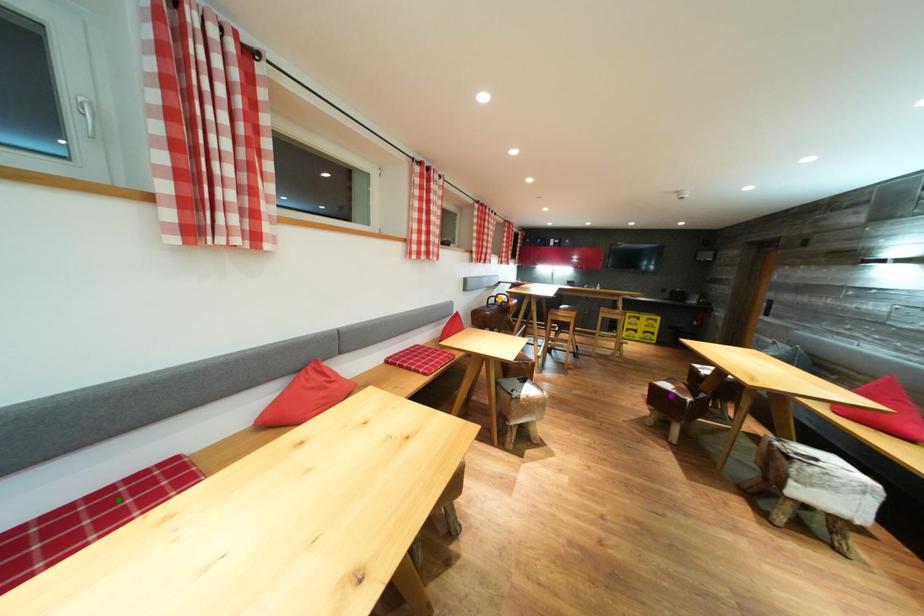
Order these from nearest to farthest:
orange point | purple point | green point

1. green point
2. purple point
3. orange point